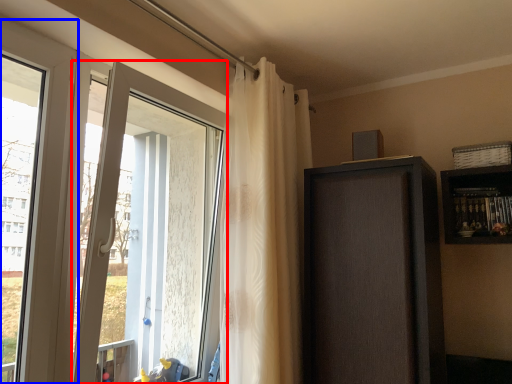
Question: Among these objects, which one is nearest to the camera, door (highlighted by a red box) or window (highlighted by a blue box)?

Choices:
 (A) door
 (B) window

Answer: (B)